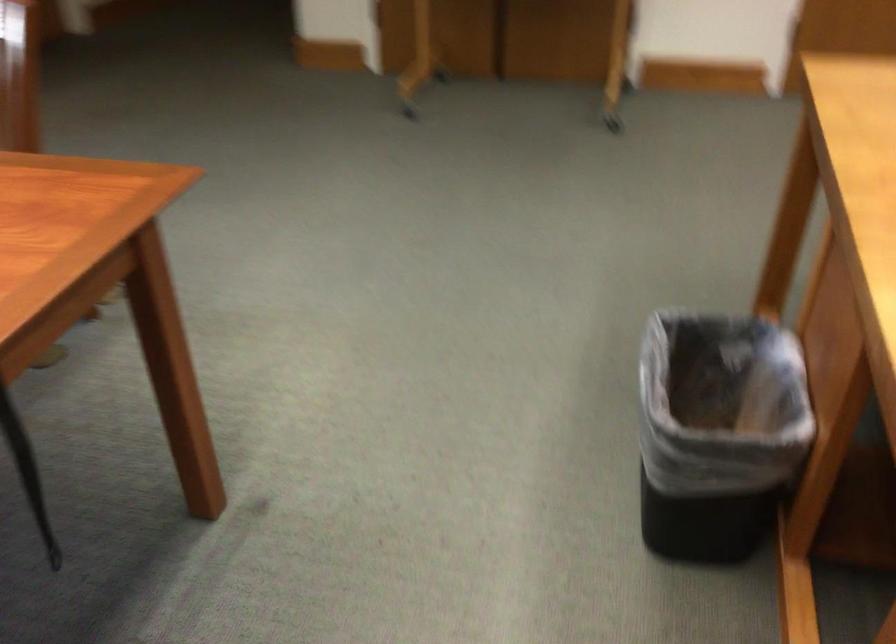
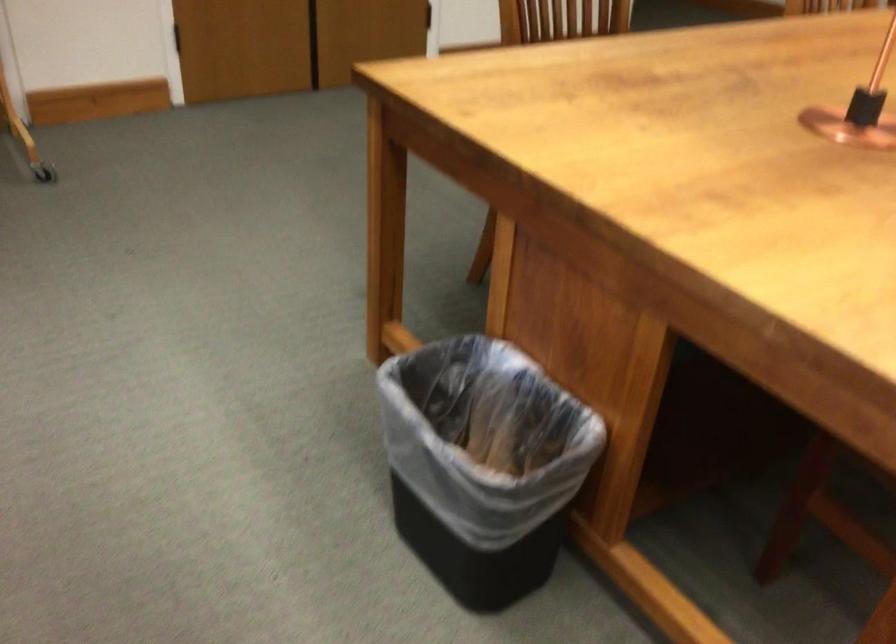
Question: The camera is either moving clockwise (left) or counter-clockwise (right) around the object. The first image is from the beginning of the video and the second image is from the end. Is the camera moving left or right when shooting the video?

Choices:
 (A) Left
 (B) Right

Answer: (A)